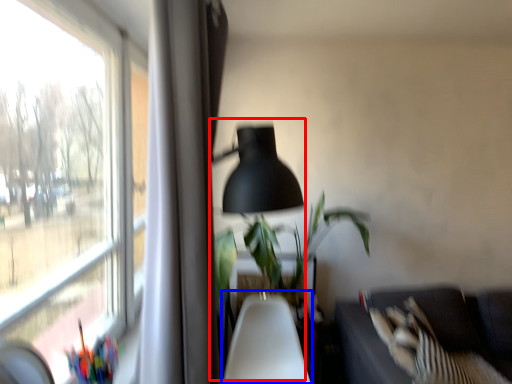
Question: Which object appears farthest to the camera in this image, table lamp (highlighted by a red box) or swivel chair (highlighted by a blue box)?

Choices:
 (A) table lamp
 (B) swivel chair

Answer: (B)